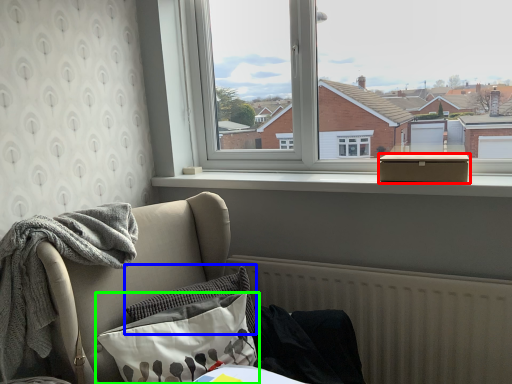
Question: Which is nearer to the box (highlighted by a red box)? pillow (highlighted by a blue box) or pillow (highlighted by a green box).

Choices:
 (A) pillow
 (B) pillow

Answer: (A)